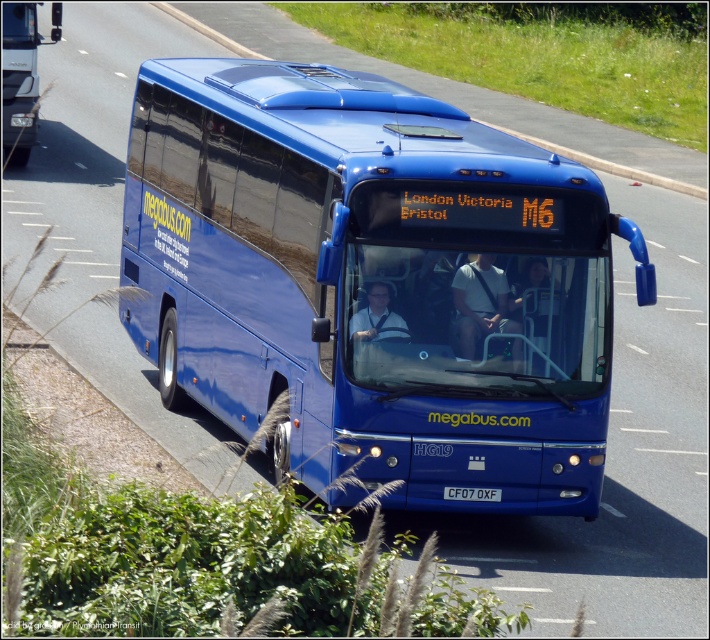
Which is more to the right, matte blue bus at upper center or white plastic license plate at center?

Positioned to the right is white plastic license plate at center.

Is matte blue bus at upper center closer to camera compared to white plastic license plate at center?

No.

What do you see at coordinates (21, 76) in the screenshot? Image resolution: width=710 pixels, height=640 pixels. I see `matte blue bus at upper center` at bounding box center [21, 76].

Image resolution: width=710 pixels, height=640 pixels. Identify the location of matte blue bus at upper center. (21, 76).

Does point (163, 300) come behind point (36, 118)?

No, it is in front of (36, 118).

Which is more to the left, blue metallic bus at center or matte blue bus at upper center?

From the viewer's perspective, matte blue bus at upper center appears more on the left side.

Is point (398, 413) less distant than point (31, 124)?

Yes, point (398, 413) is closer to viewer.

Locate an element on the screen. blue metallic bus at center is located at coordinates (368, 282).

Image resolution: width=710 pixels, height=640 pixels. What do you see at coordinates (479, 305) in the screenshot?
I see `white fabric shirt at center` at bounding box center [479, 305].

The image size is (710, 640). I want to click on white fabric shirt at center, so click(x=479, y=305).

Find the location of a particular element. white fabric shirt at center is located at coordinates (479, 305).